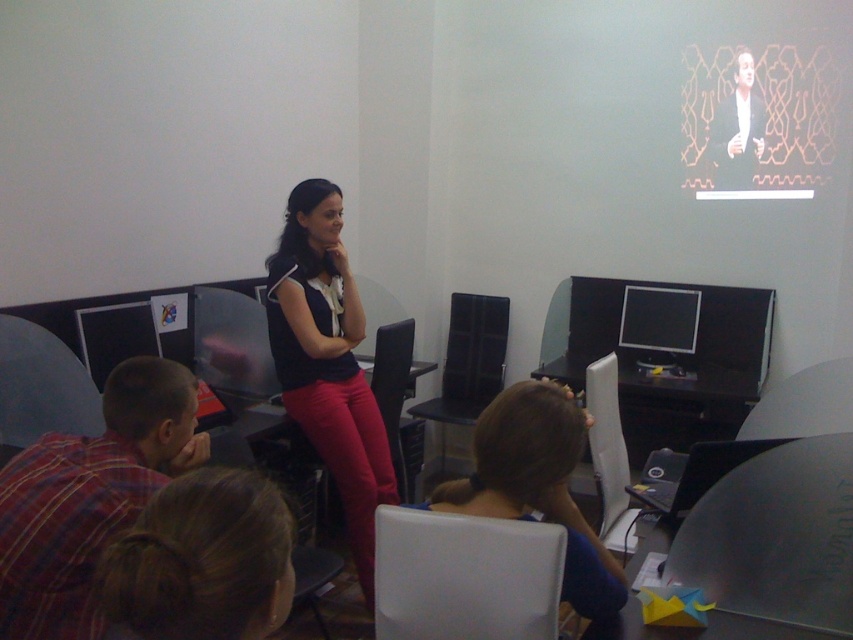
Question: Observing the image, what is the correct spatial positioning of matte black top at center in reference to matte black monitor at left?

Choices:
 (A) left
 (B) right

Answer: (B)

Question: Which point is closer to the camera?

Choices:
 (A) matte black monitor at left
 (B) plaid fabric shirt at lower left
 (C) brown hair at center

Answer: (B)

Question: Is matte black monitor at center right further to the viewer compared to matte black monitor at left?

Choices:
 (A) yes
 (B) no

Answer: (A)

Question: Which object appears farthest from the camera in this image?

Choices:
 (A) matte black top at center
 (B) matte black monitor at center right
 (C) matte black monitor at left
 (D) brown hair bun at lower center

Answer: (B)

Question: Estimate the real-world distances between objects in this image. Which object is farther from the matte black top at center?

Choices:
 (A) brown hair bun at lower center
 (B) brown hair at center

Answer: (A)

Question: Observing the image, what is the correct spatial positioning of matte black top at center in reference to brown hair at center?

Choices:
 (A) below
 (B) above

Answer: (B)